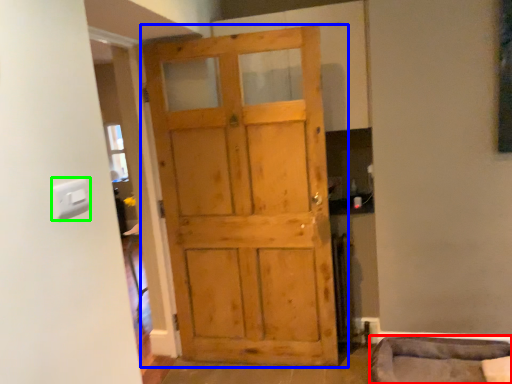
Question: Considering the real-world distances, which object is farthest from furniture (highlighted by a red box)? door (highlighted by a blue box) or light switch (highlighted by a green box)?

Choices:
 (A) door
 (B) light switch

Answer: (B)